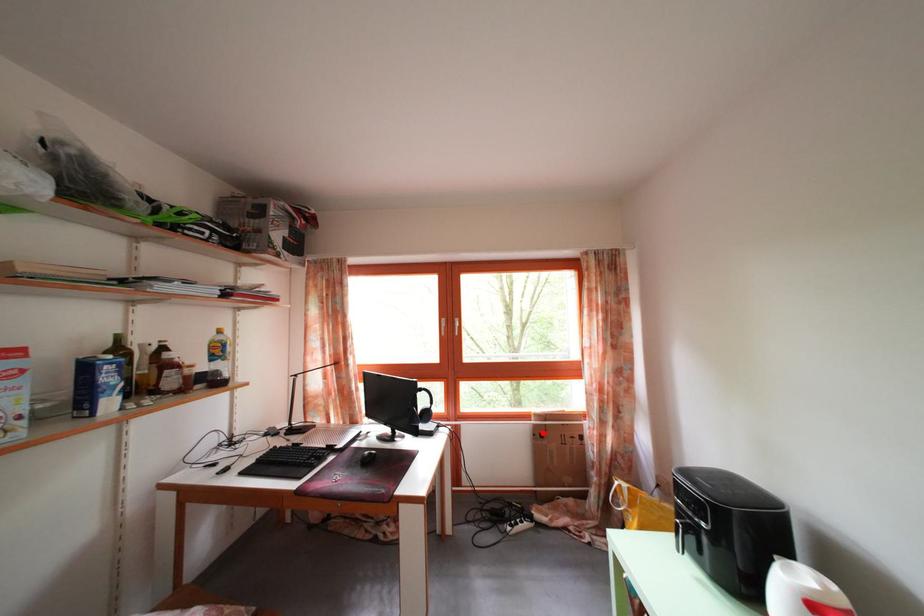
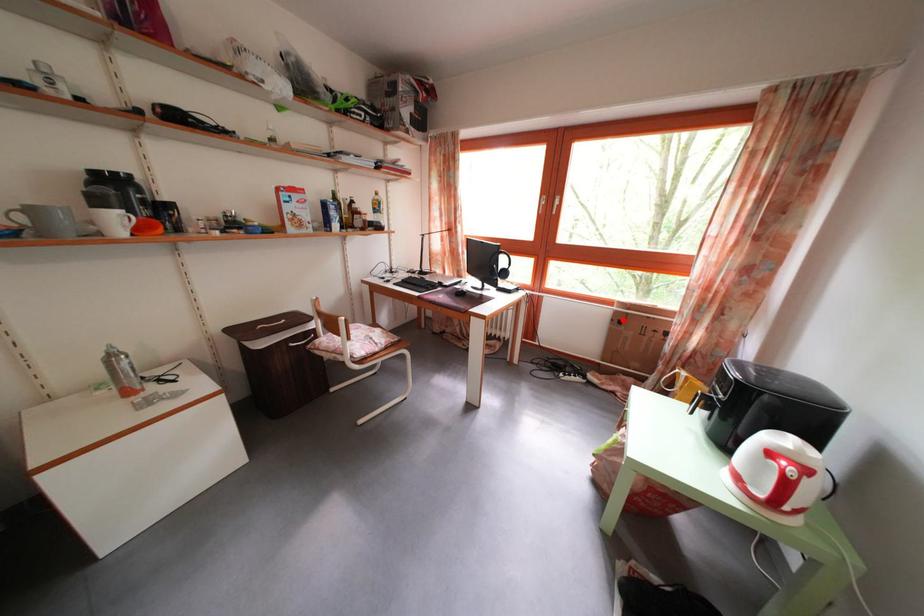
I am providing you with two images of the same scene from different viewpoints. A red point is marked on the first image and another point is marked on the second image. Are the points marked in image1 and image2 representing the same 3D position?

Yes